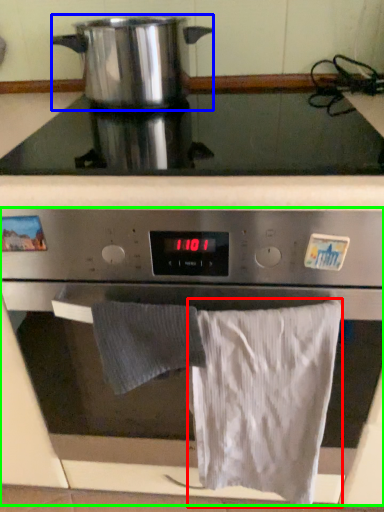
Question: Estimate the real-world distances between objects in this image. Which object is closer to bath towel (highlighted by a red box), kitchen appliance (highlighted by a blue box) or oven (highlighted by a green box)?

Choices:
 (A) kitchen appliance
 (B) oven

Answer: (B)